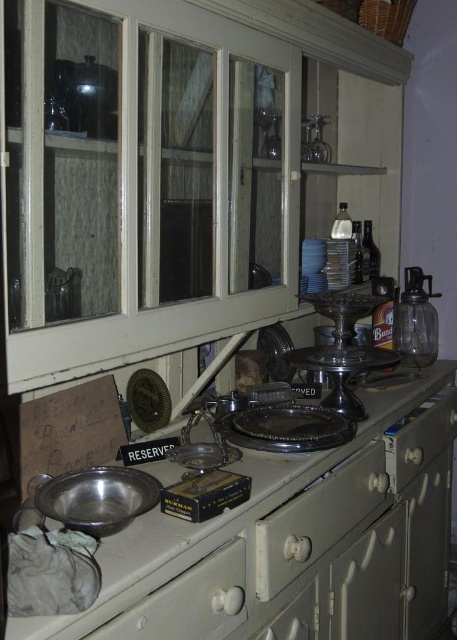
Question: Which object is positioned farthest from the white painted wood drawer at center?

Choices:
 (A) white matte drawer at lower center
 (B) metallic silver tray at center

Answer: (A)

Question: Is metallic silver tray at center to the left of white matte drawer at lower center from the viewer's perspective?

Choices:
 (A) no
 (B) yes

Answer: (A)

Question: Where is white painted wood drawer at center located in relation to white matte drawer at lower center in the image?

Choices:
 (A) below
 (B) above

Answer: (B)

Question: Which object is the farthest from the white matte drawer at lower center?

Choices:
 (A) white painted wood drawer at right
 (B) white painted wood drawer at center
 (C) metallic silver tray at center

Answer: (A)

Question: Which point is farther to the camera?

Choices:
 (A) white matte drawer at lower center
 (B) white painted wood drawer at center

Answer: (B)

Question: In this image, where is metallic silver tray at center located relative to white painted wood drawer at right?

Choices:
 (A) below
 (B) above

Answer: (A)